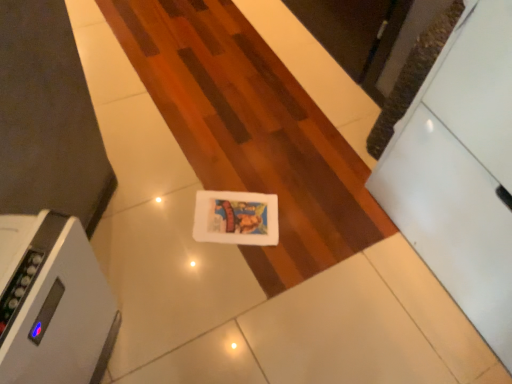
Question: From the image's perspective, is white glossy drawer at right above or below gray plastic air purifier at lower left?

Choices:
 (A) below
 (B) above

Answer: (B)

Question: Would you say white glossy drawer at right is to the left or to the right of gray plastic air purifier at lower left in the picture?

Choices:
 (A) left
 (B) right

Answer: (B)

Question: From a real-world perspective, is white glossy drawer at right physically located above or below gray plastic air purifier at lower left?

Choices:
 (A) above
 (B) below

Answer: (A)

Question: Does point (84, 327) appear closer or farther from the camera than point (398, 165)?

Choices:
 (A) farther
 (B) closer

Answer: (B)

Question: From the image's perspective, is gray plastic air purifier at lower left above or below white glossy drawer at right?

Choices:
 (A) below
 (B) above

Answer: (A)

Question: From a real-world perspective, is gray plastic air purifier at lower left above or below white glossy drawer at right?

Choices:
 (A) above
 (B) below

Answer: (B)

Question: Considering the positions of gray plastic air purifier at lower left and white glossy drawer at right in the image, is gray plastic air purifier at lower left wider or thinner than white glossy drawer at right?

Choices:
 (A) thin
 (B) wide

Answer: (A)